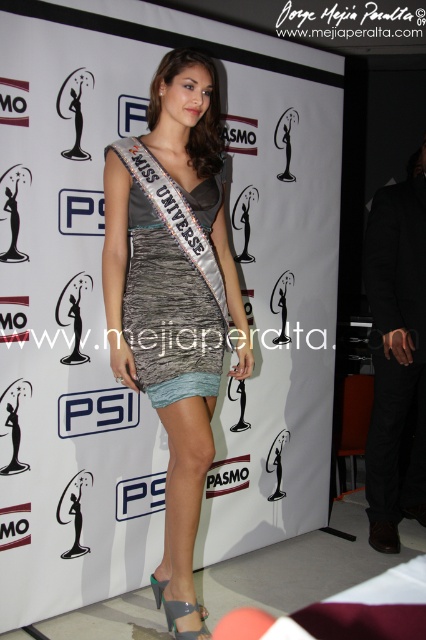
In the scene shown: Is satin dress at center smaller than shiny metallic sandal at lower center?

Actually, satin dress at center might be larger than shiny metallic sandal at lower center.

Is satin dress at center wider than shiny metallic sandal at lower center?

Yes, satin dress at center is wider than shiny metallic sandal at lower center.

What do you see at coordinates (173, 285) in the screenshot? The image size is (426, 640). I see `satin dress at center` at bounding box center [173, 285].

At what (x,y) coordinates should I click in order to perform the action: click on satin dress at center. Please return your answer as a coordinate pair (x, y). The image size is (426, 640). Looking at the image, I should click on (173, 285).

Who is positioned more to the right, satin dress at center or shiny metallic dress at center?

satin dress at center is more to the right.

Does satin dress at center appear on the right side of shiny metallic dress at center?

Yes, satin dress at center is to the right of shiny metallic dress at center.

Identify the location of satin dress at center. (173, 285).

Is shiny metallic dress at center smaller than shiny metallic sandal at lower center?

No.

Who is lower down, shiny metallic dress at center or shiny metallic sandal at lower center?

shiny metallic sandal at lower center is lower down.

What do you see at coordinates (170, 273) in the screenshot? I see `shiny metallic dress at center` at bounding box center [170, 273].

Identify the location of shiny metallic dress at center. Image resolution: width=426 pixels, height=640 pixels. (170, 273).